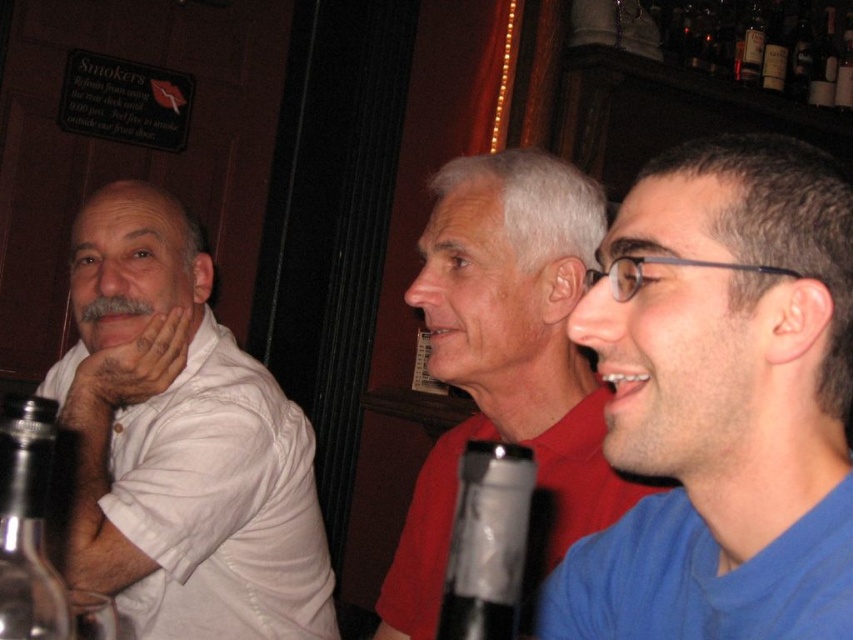
Which is in front, point (775, 602) or point (490, 285)?

Point (775, 602)

Does blue fabric shirt at right have a smaller size compared to red matte shirt at center?

Indeed, blue fabric shirt at right has a smaller size compared to red matte shirt at center.

Does point (763, 627) lie in front of point (526, 397)?

Yes, it is.

Where is `blue fabric shirt at right`? This screenshot has height=640, width=853. blue fabric shirt at right is located at coordinates (722, 403).

Which is in front, point (456, 182) or point (498, 536)?

Point (498, 536)

Is red matte shirt at center positioned in front of translucent glass bottle at center?

No.

What do you see at coordinates (508, 364) in the screenshot? I see `red matte shirt at center` at bounding box center [508, 364].

I want to click on red matte shirt at center, so click(508, 364).

Does white matte shirt at left appear over clear glass bottle at upper right?

Incorrect, white matte shirt at left is not positioned above clear glass bottle at upper right.

Does point (184, 573) lie in front of point (758, 65)?

That is True.

The width and height of the screenshot is (853, 640). Find the location of `white matte shirt at left`. white matte shirt at left is located at coordinates (180, 442).